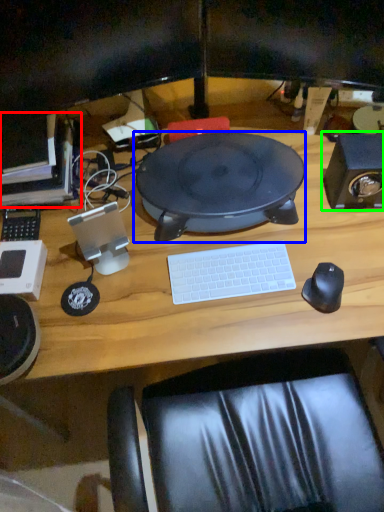
Question: Which object is the farthest from computer (highlighted by a red box)? Choose among these: sit (highlighted by a blue box) or speaker (highlighted by a green box).

Choices:
 (A) sit
 (B) speaker

Answer: (B)